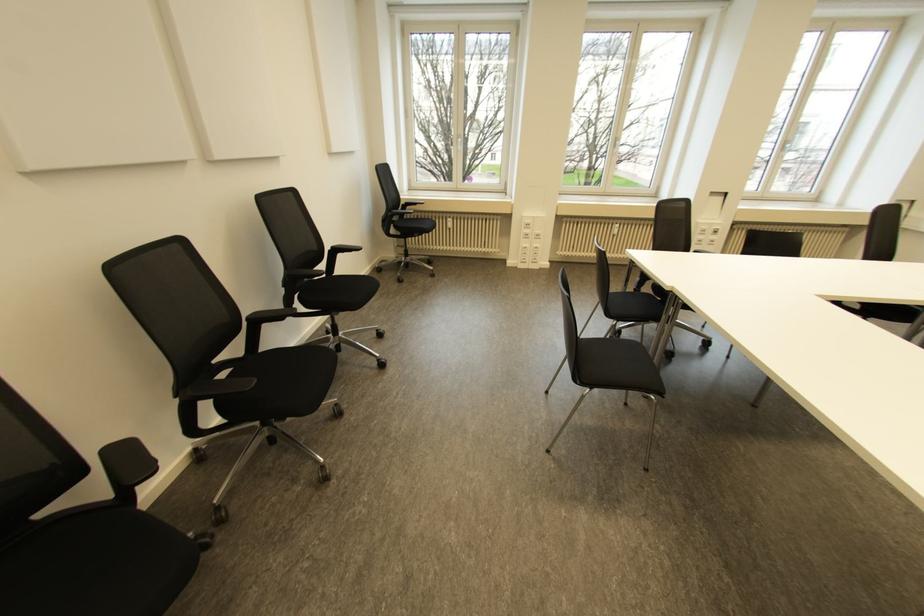
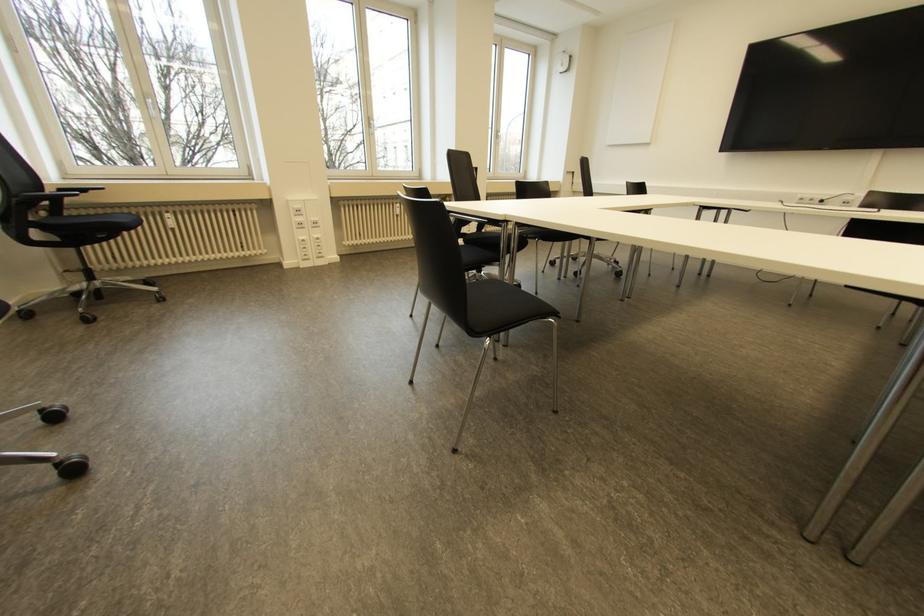
Question: Based on the continuous images, in which direction is the camera rotating? Reply with the corresponding letter.

Choices:
 (A) Left
 (B) Right
 (C) Up
 (D) Down

Answer: (B)